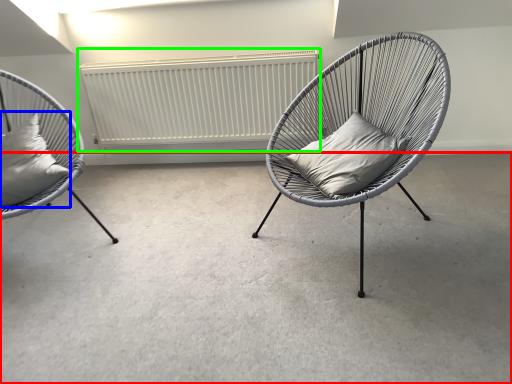
Question: Which object is the closest to the concrete (highlighted by a red box)? Choose among these: pillow (highlighted by a blue box) or radiator (highlighted by a green box).

Choices:
 (A) pillow
 (B) radiator

Answer: (A)